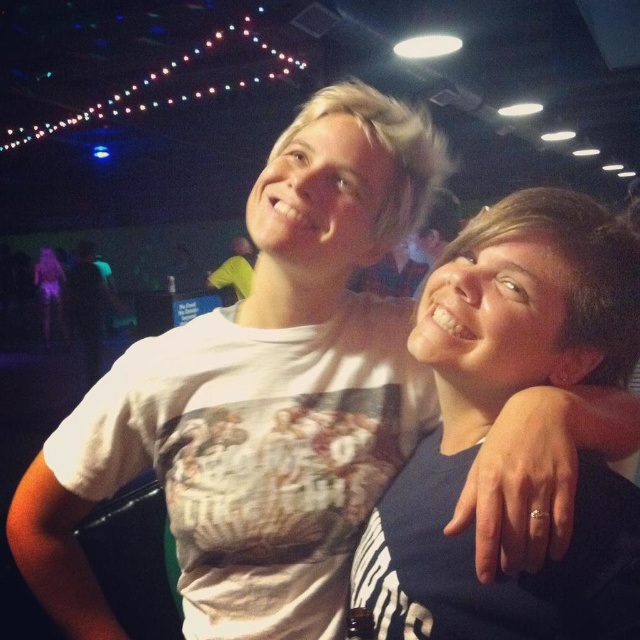
Between point (436, 630) and point (250, 257), which one is positioned in front?

Point (436, 630)

How much distance is there between dark blue shirt at center and yellow t-shirt at center?

dark blue shirt at center is 4.77 meters away from yellow t-shirt at center.

Image resolution: width=640 pixels, height=640 pixels. In order to click on dark blue shirt at center in this screenshot , I will do `click(493, 417)`.

Identify the location of dark blue shirt at center. The width and height of the screenshot is (640, 640). (493, 417).

Can you confirm if matte white t-shirt at center is smaller than yellow t-shirt at center?

Incorrect, matte white t-shirt at center is not smaller in size than yellow t-shirt at center.

Between matte white t-shirt at center and yellow t-shirt at center, which one appears on the left side from the viewer's perspective?

matte white t-shirt at center is more to the left.

Which is in front, point (48, 252) or point (241, 280)?

Positioned in front is point (241, 280).

At what (x,y) coordinates should I click in order to perform the action: click on matte white t-shirt at center. Please return your answer as a coordinate pair (x, y). This screenshot has height=640, width=640. Looking at the image, I should click on (49, 296).

Is dark green shirt at left above matte white t-shirt at center?

Incorrect, dark green shirt at left is not positioned above matte white t-shirt at center.

Is dark green shirt at left to the right of matte white t-shirt at center from the viewer's perspective?

Correct, you'll find dark green shirt at left to the right of matte white t-shirt at center.

What do you see at coordinates (88, 307) in the screenshot? This screenshot has height=640, width=640. I see `dark green shirt at left` at bounding box center [88, 307].

Identify the location of dark green shirt at left. (88, 307).